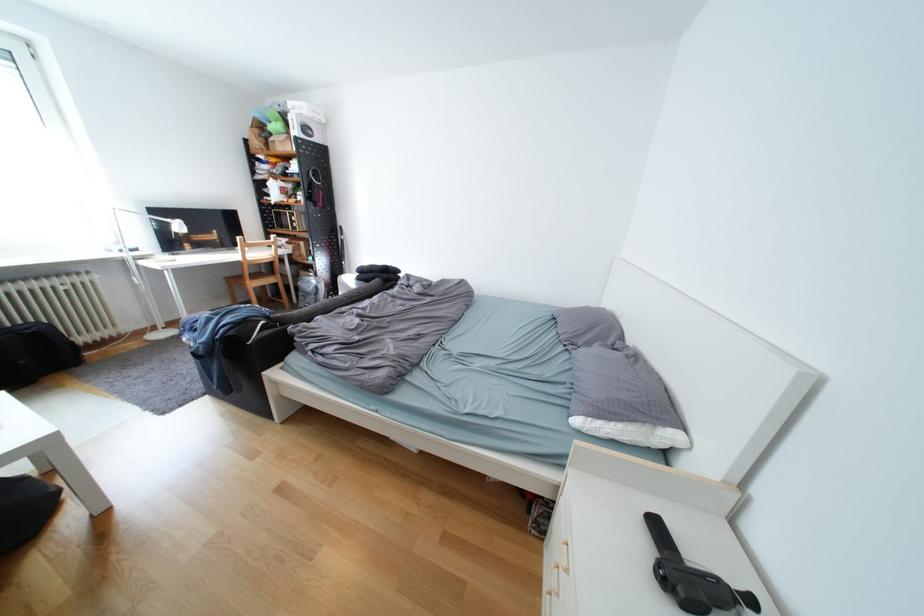
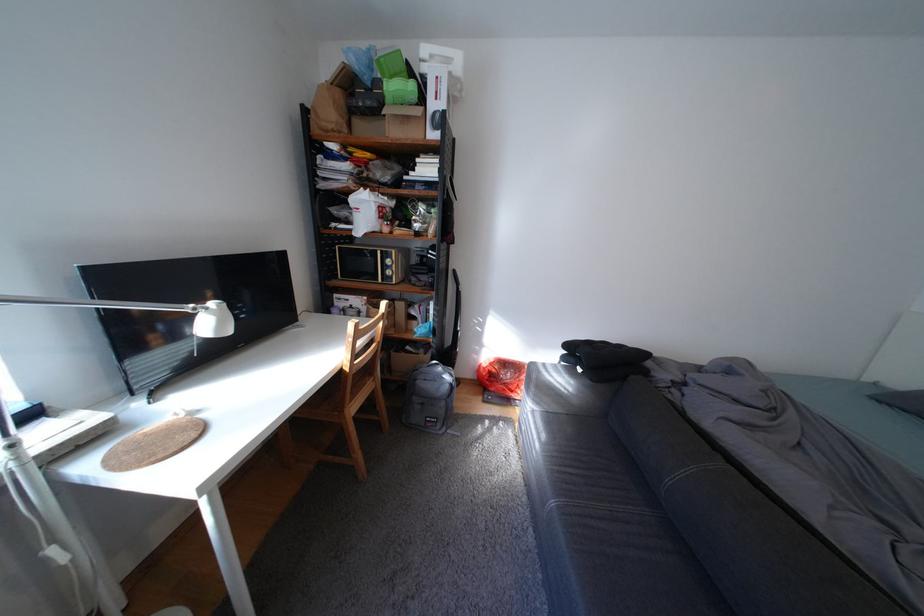
In the second image, find the point that corresponds to pixel 270 132 in the first image.

(351, 95)